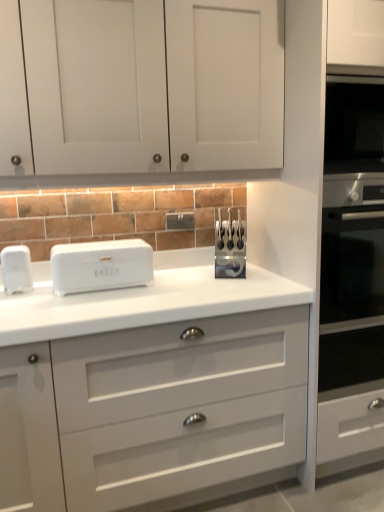
The width and height of the screenshot is (384, 512). I want to click on unoccupied region to the right of white glossy bread bin at center, placed as the second home appliance when sorted from left to right, so click(180, 288).